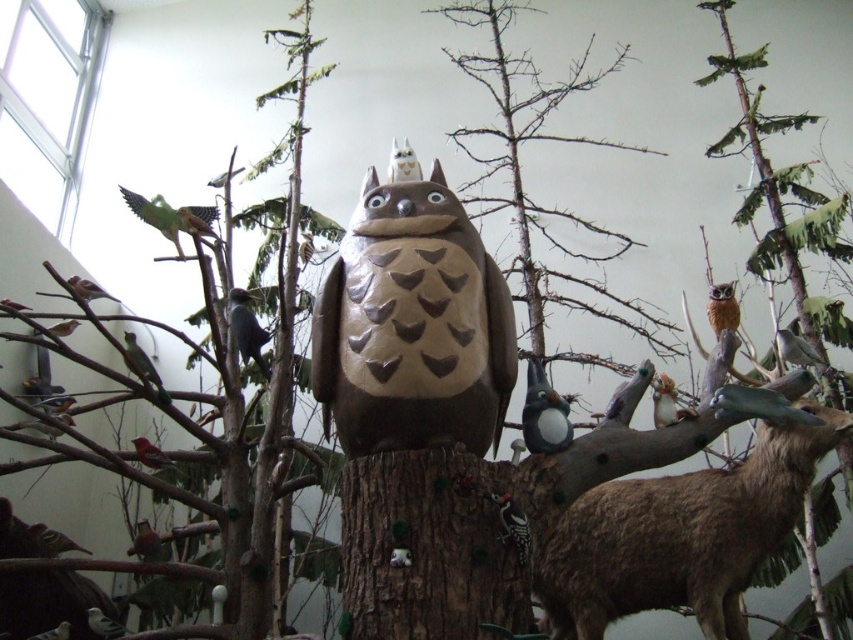
Question: Which of the following is the closest to the observer?

Choices:
 (A) (779, 337)
 (B) (422, 474)
 (C) (187, 220)
 (D) (715, 332)

Answer: (B)

Question: Is brown matte owl at upper right above matte red bird at center?

Choices:
 (A) no
 (B) yes

Answer: (B)

Question: Which point is closer to the camera?

Choices:
 (A) matte red bird at center
 (B) brown rough bark at center
 (C) matte gray bird at center
 (D) matte gray bird at left

Answer: (B)

Question: Which is nearer to the brown speckled feathers at upper left?

Choices:
 (A) brown speckled feathers at upper right
 (B) matte green leaf at upper center

Answer: (B)

Question: Does shiny black bird at center come in front of matte red bird at center?

Choices:
 (A) no
 (B) yes

Answer: (A)

Question: Is white matte bird at center further to the viewer compared to shiny black bird at center?

Choices:
 (A) yes
 (B) no

Answer: (B)